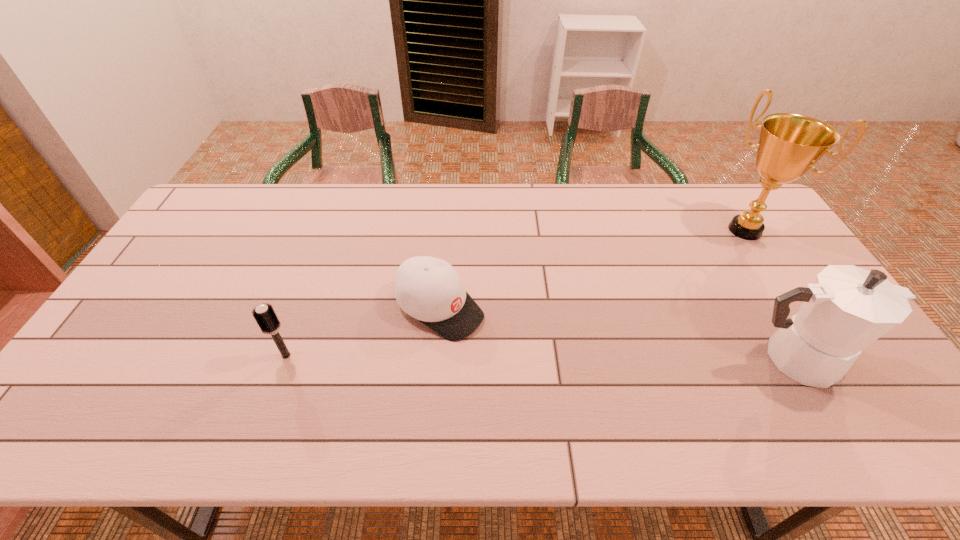
At what (x,y) coordinates should I click in order to perform the action: click on free space on the desktop that is between the hairbrush and the second tallest object and is positioned on the front view with handles of the award. Please return your answer as a coordinate pair (x, y). Looking at the image, I should click on [595, 357].

The height and width of the screenshot is (540, 960). What are the coordinates of `free space on the desktop that is between the third tallest object and the coffeepot and is positioned on the front-facing side of the baseball cap` in the screenshot? It's located at (514, 357).